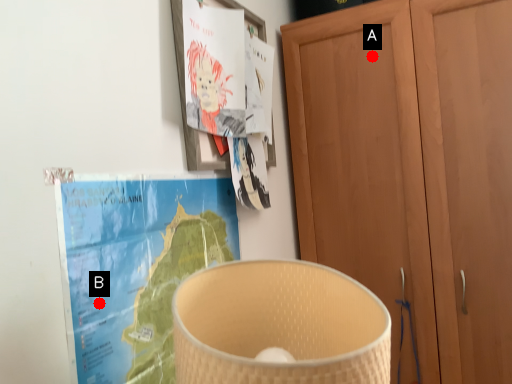
Question: Two points are circled on the image, labeled by A and B beside each circle. Which point appears farthest from the camera in this image?

Choices:
 (A) A is further
 (B) B is further

Answer: (A)